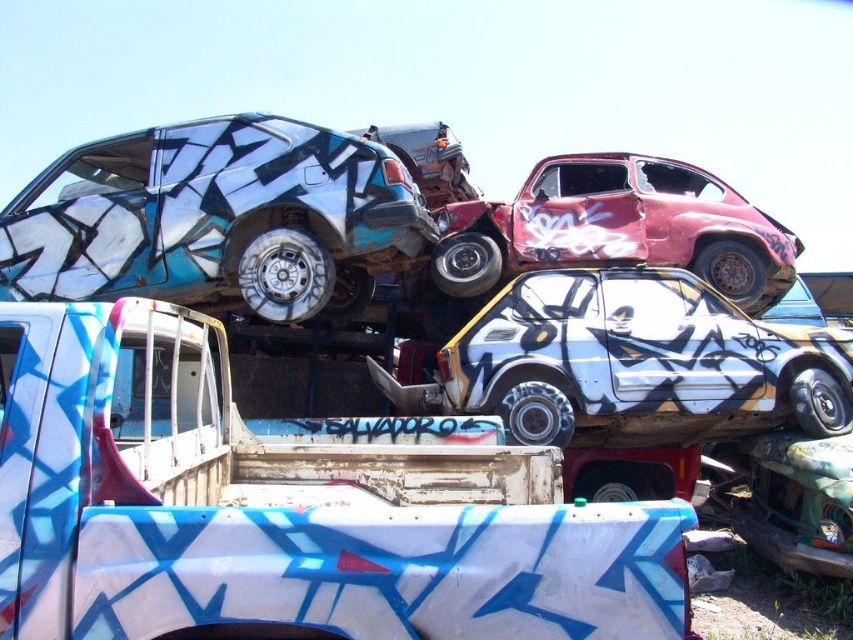
Can you confirm if white matte truck bed at lower left is bigger than white matte car at center?

Incorrect, white matte truck bed at lower left is not larger than white matte car at center.

This screenshot has width=853, height=640. What do you see at coordinates (287, 508) in the screenshot?
I see `white matte truck bed at lower left` at bounding box center [287, 508].

The width and height of the screenshot is (853, 640). In order to click on white matte truck bed at lower left in this screenshot , I will do `click(287, 508)`.

Who is more distant from viewer, (x=177, y=243) or (x=469, y=241)?

The point (x=469, y=241) is more distant.

Find the location of a particular element. The height and width of the screenshot is (640, 853). blue painted metal car at upper left is located at coordinates (218, 218).

In order to click on blue painted metal car at upper left in this screenshot , I will do `click(218, 218)`.

Identify the location of blue painted metal car at upper left. (218, 218).

How distant is white matte truck bed at lower left from blue painted metal car at upper left?

They are 8.14 feet apart.

Does white matte truck bed at lower left have a greater height compared to blue painted metal car at upper left?

No, white matte truck bed at lower left is not taller than blue painted metal car at upper left.

Does point (90, 380) lie in front of point (119, 289)?

Yes, it is.

Where is `white matte truck bed at lower left`? The width and height of the screenshot is (853, 640). white matte truck bed at lower left is located at coordinates (287, 508).